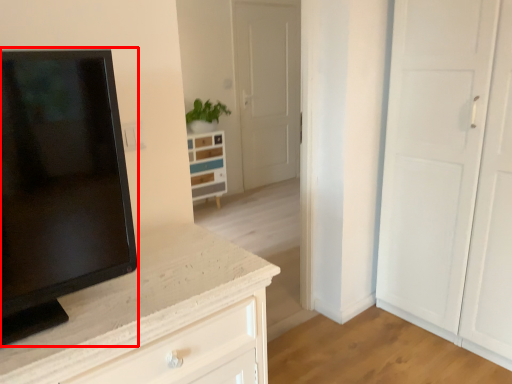
Question: From the image's perspective, where is screen (annotated by the red box) located relative to chest of drawers?

Choices:
 (A) above
 (B) below

Answer: (B)